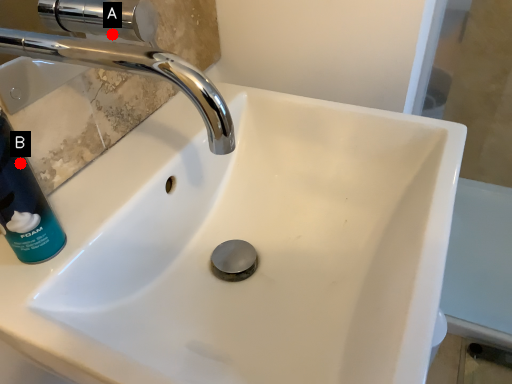
Question: Two points are circled on the image, labeled by A and B beside each circle. Which point is farther to the camera?

Choices:
 (A) A is further
 (B) B is further

Answer: (A)